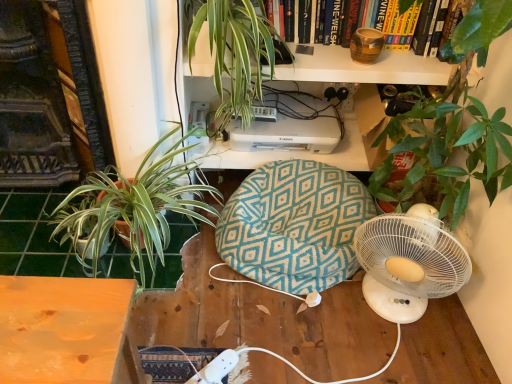
This screenshot has height=384, width=512. I want to click on vacant point to the right of green tile at lower left, so click(222, 296).